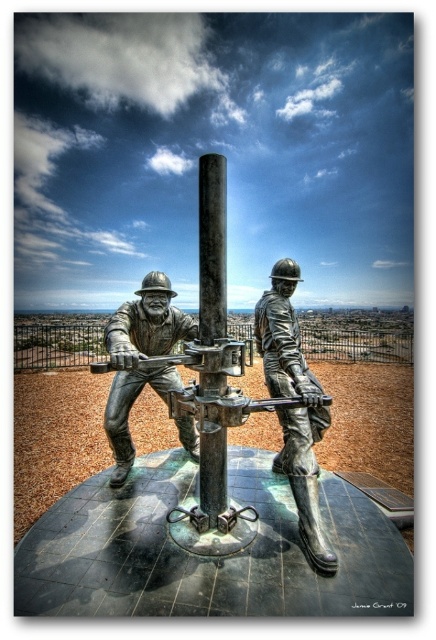
Consider the image. You are an art critic analyzing the composition of the bronze statue. Based on the spatial arrangement of the polished metal pole at center and the bronze statue of man at center, which object is located to the right of the other?

The polished metal pole at center is positioned on the right side of bronze statue of man at center.

You are standing in front of the bronze statue of two workers and a tall cylindrical metal structure. You notice a point marked at coordinate (317, 547). If you want to touch this point without moving your feet, is it within your reach? Assume your arm can extend 1.5 meters.

The point at (317, 547) is 3.38 meters from the camera. Since your arm can only extend 1.5 meters, you cannot reach it without moving your feet.